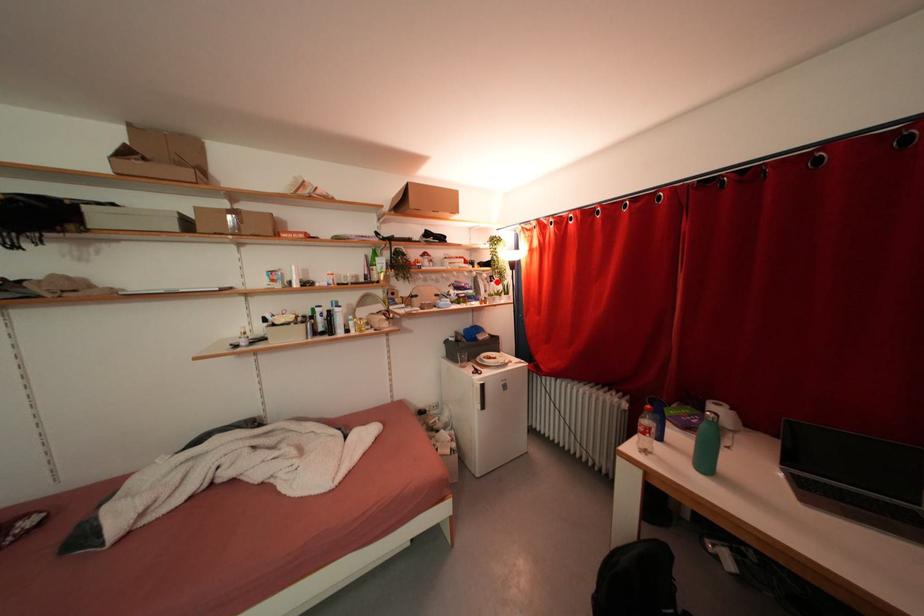
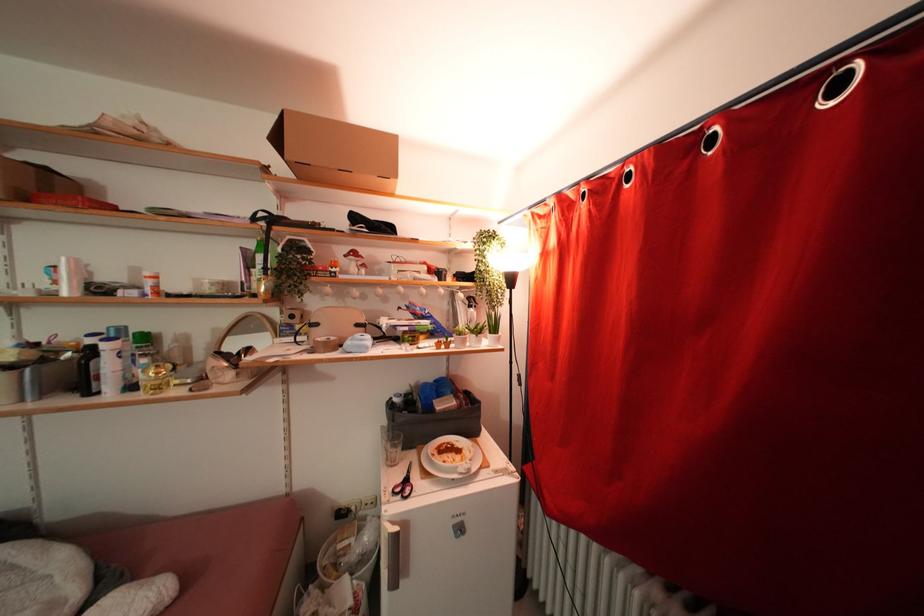
In the second image, find the point that corresponds to the highlighted location in the first image.

(477, 305)